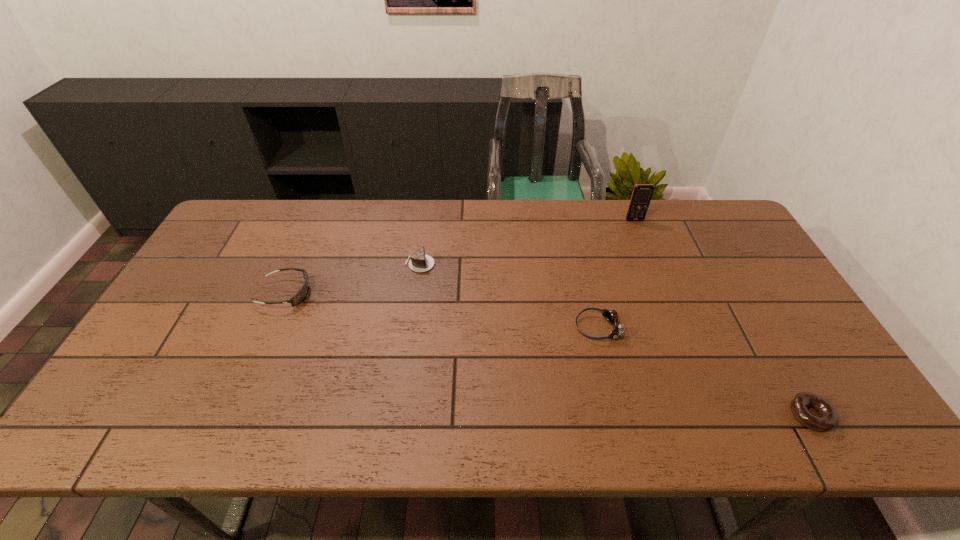
What are the coordinates of `vacant space located 0.140m on the screen of the cellular telephone` in the screenshot? It's located at (646, 248).

Find the location of `free space located 0.270m on the lenses of the leftmost object`. free space located 0.270m on the lenses of the leftmost object is located at coordinates (405, 293).

Image resolution: width=960 pixels, height=540 pixels. I want to click on vacant region located 0.240m on the right of the chocolate cake, so click(513, 264).

The height and width of the screenshot is (540, 960). Find the location of `vacant space located through the lenses of the nearer goggles`. vacant space located through the lenses of the nearer goggles is located at coordinates (437, 328).

Find the location of a particular element. The height and width of the screenshot is (540, 960). vacant space located through the lenses of the nearer goggles is located at coordinates (538, 328).

Locate an element on the screen. blank space located 0.240m through the lenses of the nearer goggles is located at coordinates (485, 328).

I want to click on free space located 0.340m on the back of the nearest object, so click(740, 291).

Find the location of a particular element. Image resolution: width=960 pixels, height=540 pixels. object at the far edge is located at coordinates (642, 193).

At what (x,y) coordinates should I click in order to perform the action: click on object present at the near edge. Please return your answer as a coordinate pair (x, y). The image size is (960, 540). Looking at the image, I should click on (828, 419).

I want to click on object that is at the right edge, so click(828, 419).